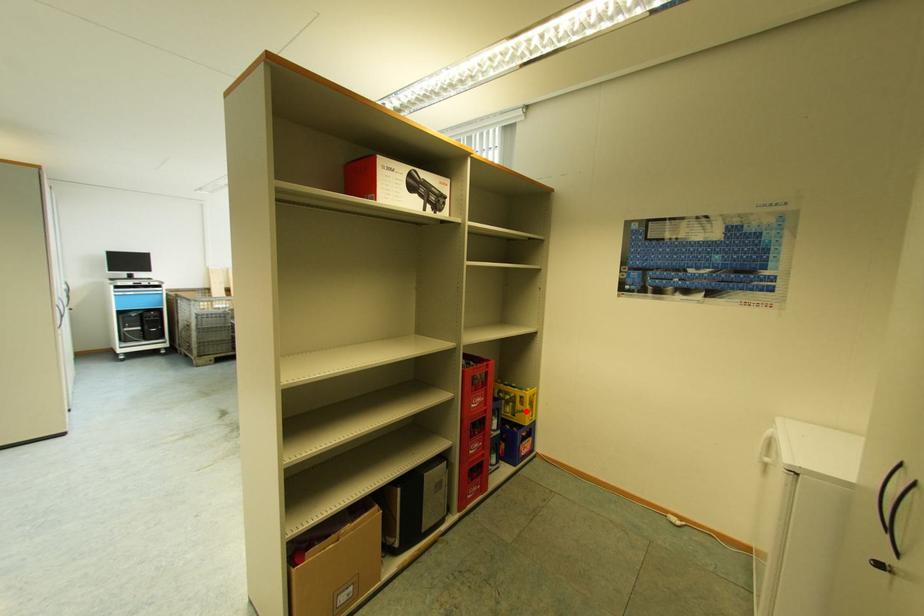
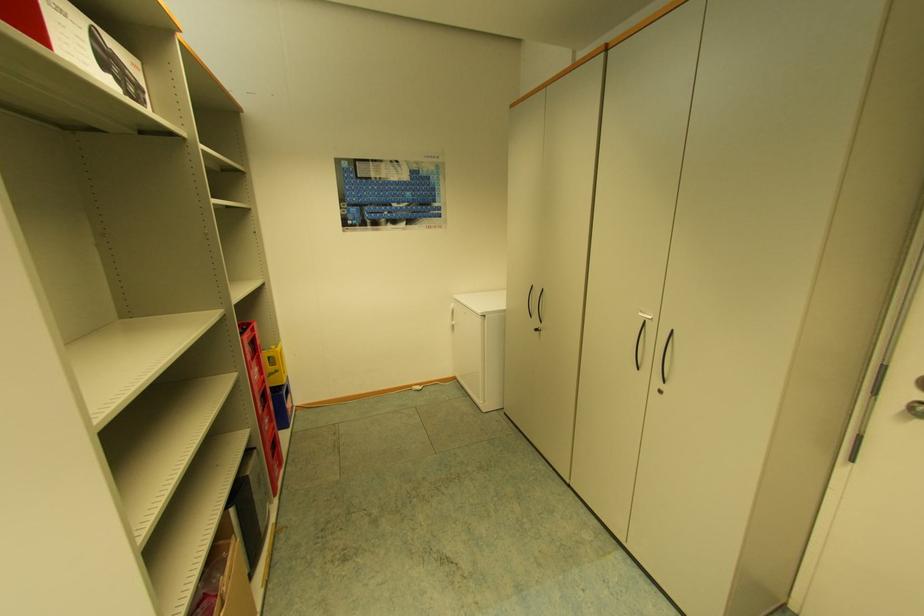
Question: I am providing you with two images of the same scene from different viewpoints. Given a red point in image1, look at the same physical point in image2. Is it:

Choices:
 (A) Closer to the viewpoint
 (B) Farther from the viewpoint

Answer: (A)